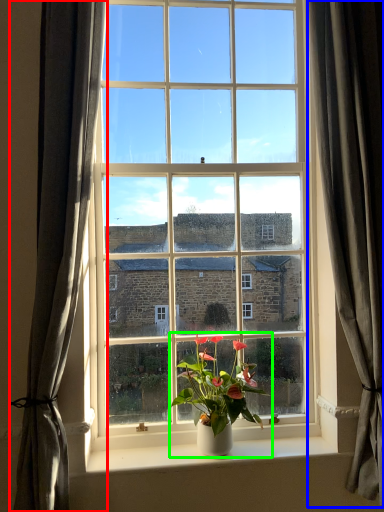
Question: Estimate the real-world distances between objects in this image. Which object is farther from curtain (highlighted by a red box), curtain (highlighted by a blue box) or houseplant (highlighted by a green box)?

Choices:
 (A) curtain
 (B) houseplant

Answer: (A)